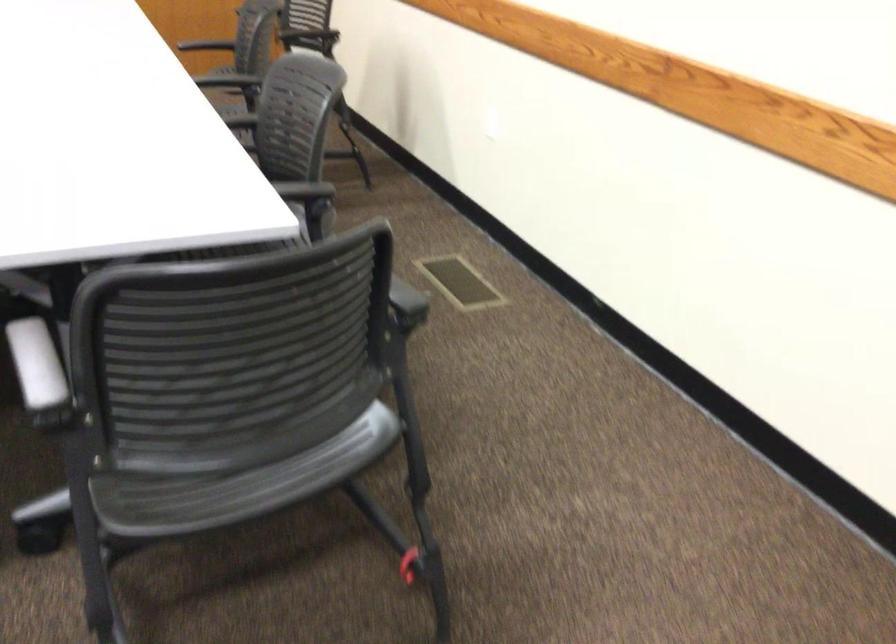
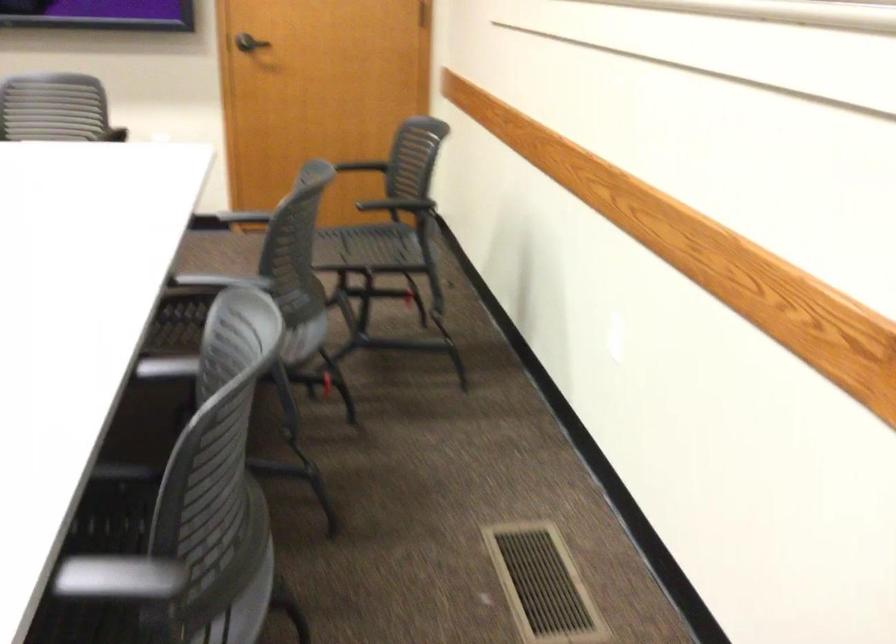
Question: The camera is either moving clockwise (left) or counter-clockwise (right) around the object. The first image is from the beginning of the video and the second image is from the end. Is the camera moving left or right when shooting the video?

Choices:
 (A) Left
 (B) Right

Answer: (B)